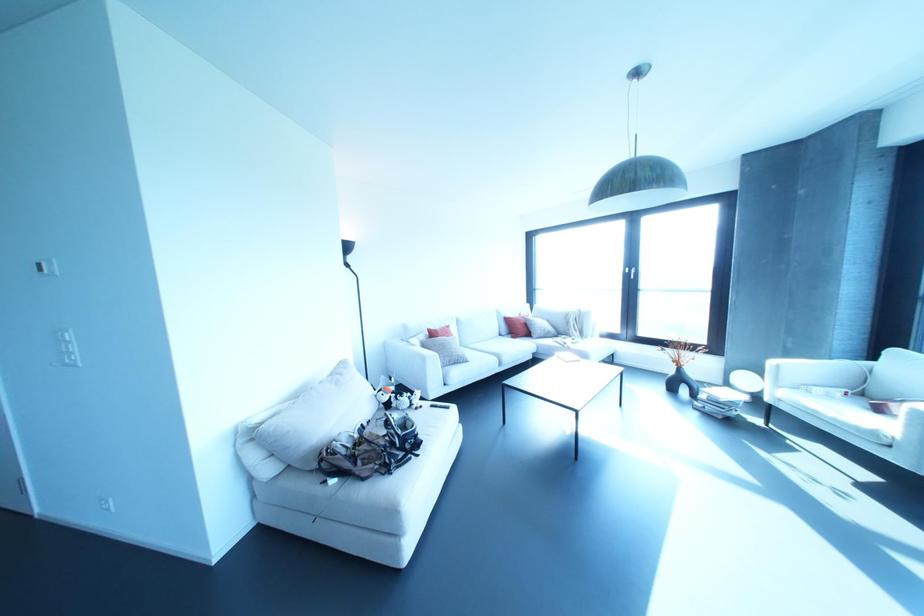
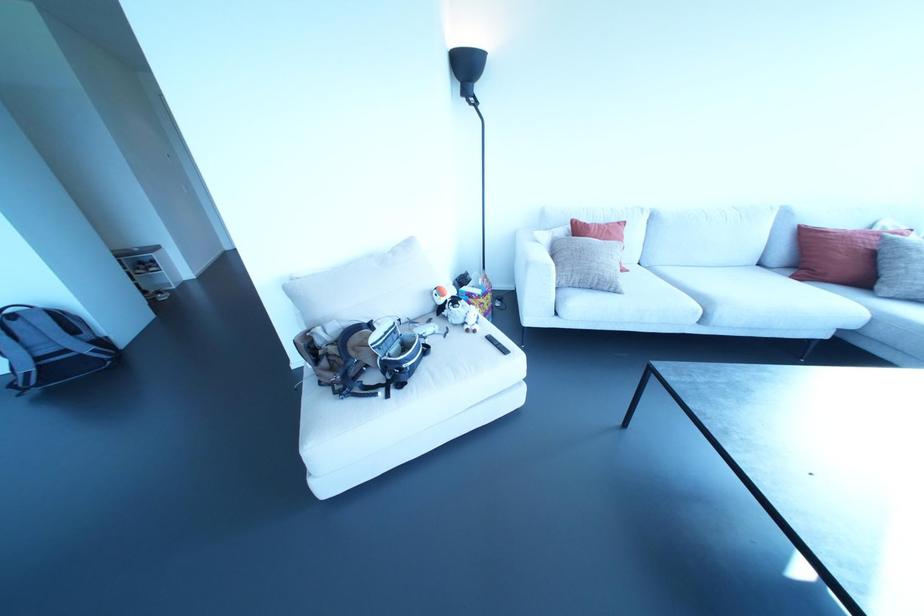
Find the pixel in the second image that matches pixel 416 408 in the first image.

(467, 330)